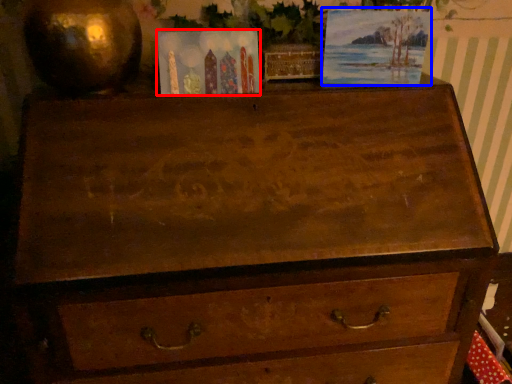
Question: Which object appears farthest to the camera in this image, postcard (highlighted by a red box) or picture frame (highlighted by a blue box)?

Choices:
 (A) postcard
 (B) picture frame

Answer: (B)